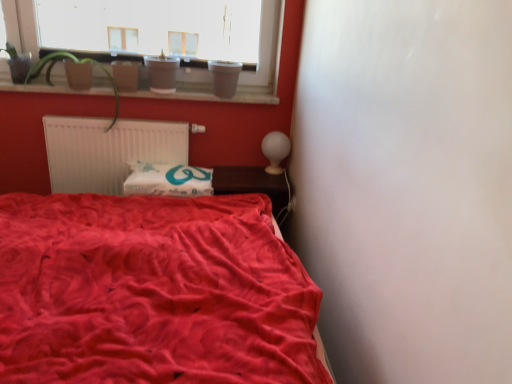
Question: Considering the relative sizes of smooth wooden window sill at upper center and white paper at center in the image provided, is smooth wooden window sill at upper center taller than white paper at center?

Choices:
 (A) no
 (B) yes

Answer: (A)

Question: From a real-world perspective, is smooth wooden window sill at upper center located beneath white paper at center?

Choices:
 (A) yes
 (B) no

Answer: (B)

Question: From a real-world perspective, is smooth wooden window sill at upper center over white paper at center?

Choices:
 (A) no
 (B) yes

Answer: (B)

Question: Is smooth wooden window sill at upper center not inside white paper at center?

Choices:
 (A) yes
 (B) no

Answer: (A)

Question: Can white paper at center be found inside smooth wooden window sill at upper center?

Choices:
 (A) no
 (B) yes

Answer: (A)

Question: Is smooth wooden window sill at upper center touching white paper at center?

Choices:
 (A) no
 (B) yes

Answer: (A)

Question: Can you confirm if white paper at center is shorter than green matte plant at upper left?

Choices:
 (A) no
 (B) yes

Answer: (B)

Question: Can you confirm if white paper at center is positioned to the right of green matte plant at upper left?

Choices:
 (A) yes
 (B) no

Answer: (A)

Question: Considering the relative sizes of white paper at center and green matte plant at upper left in the image provided, is white paper at center smaller than green matte plant at upper left?

Choices:
 (A) no
 (B) yes

Answer: (B)

Question: Is white paper at center to the left of green matte plant at upper left from the viewer's perspective?

Choices:
 (A) no
 (B) yes

Answer: (A)

Question: Does white paper at center have a greater height compared to green matte plant at upper left?

Choices:
 (A) yes
 (B) no

Answer: (B)

Question: Does white paper at center come in front of green matte plant at upper left?

Choices:
 (A) no
 (B) yes

Answer: (A)

Question: Is velvet red bed at lower left smaller than smooth wooden window sill at upper center?

Choices:
 (A) yes
 (B) no

Answer: (B)